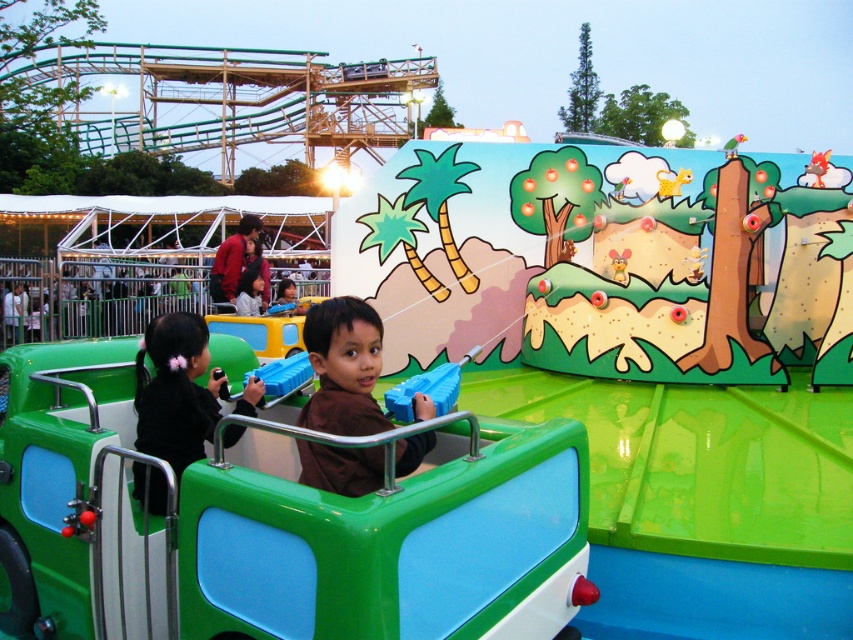
Question: Among these objects, which one is farthest from the camera?

Choices:
 (A) black matte hair at center
 (B) blue plastic handle at center

Answer: (B)

Question: Which point is closer to the camera?

Choices:
 (A) (157, 408)
 (B) (442, 392)
 (C) (247, 547)
 (D) (352, 372)

Answer: (C)

Question: Is shiny plastic toy car at center smaller than black matte hair at center?

Choices:
 (A) yes
 (B) no

Answer: (B)

Question: Does brown matte shirt at center have a larger size compared to blue plastic handle at center?

Choices:
 (A) yes
 (B) no

Answer: (A)

Question: Estimate the real-world distances between objects in this image. Which object is closer to the brown matte shirt at center?

Choices:
 (A) black matte hair at center
 (B) blue plastic handle at center
 (C) shiny plastic toy car at center

Answer: (B)

Question: Is shiny plastic toy car at center to the right of brown matte shirt at center from the viewer's perspective?

Choices:
 (A) no
 (B) yes

Answer: (A)